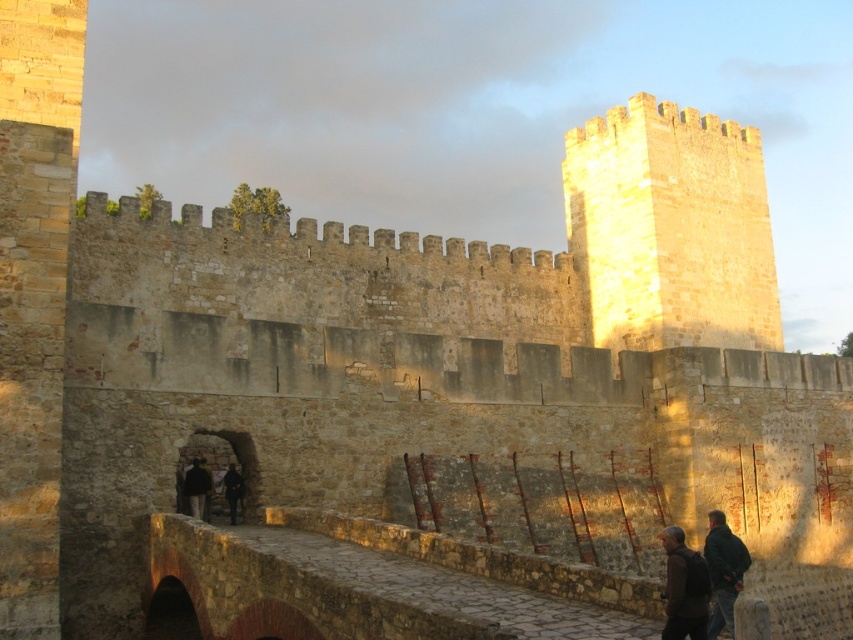
Can you confirm if dark brown leather jacket at lower right is positioned to the left of black matte jacket at lower left?

In fact, dark brown leather jacket at lower right is to the right of black matte jacket at lower left.

Who is shorter, dark brown leather jacket at lower right or black matte jacket at lower left?

black matte jacket at lower left

Find the location of a particular element. dark brown leather jacket at lower right is located at coordinates (683, 588).

The width and height of the screenshot is (853, 640). Identify the location of dark brown leather jacket at lower right. (683, 588).

Does dark green jacket at lower right lie in front of black matte jacket at lower left?

Yes.

Can you confirm if dark green jacket at lower right is positioned to the right of black matte jacket at lower left?

Correct, you'll find dark green jacket at lower right to the right of black matte jacket at lower left.

At what (x,y) coordinates should I click in order to perform the action: click on dark green jacket at lower right. Please return your answer as a coordinate pair (x, y). This screenshot has height=640, width=853. Looking at the image, I should click on (723, 572).

Which of these two, black matte jacket at lower left or dark brown leather jacket at center, stands shorter?

Standing shorter between the two is dark brown leather jacket at center.

Can you confirm if black matte jacket at lower left is positioned to the right of dark brown leather jacket at center?

Incorrect, black matte jacket at lower left is not on the right side of dark brown leather jacket at center.

Where is `black matte jacket at lower left`? black matte jacket at lower left is located at coordinates (196, 486).

You are a GUI agent. You are given a task and a screenshot of the screen. Output one action in this format:
    pyautogui.click(x=<x>, y=<y>)
    Task: Click on the black matte jacket at lower left
    
    Given the screenshot: What is the action you would take?
    [196, 486]